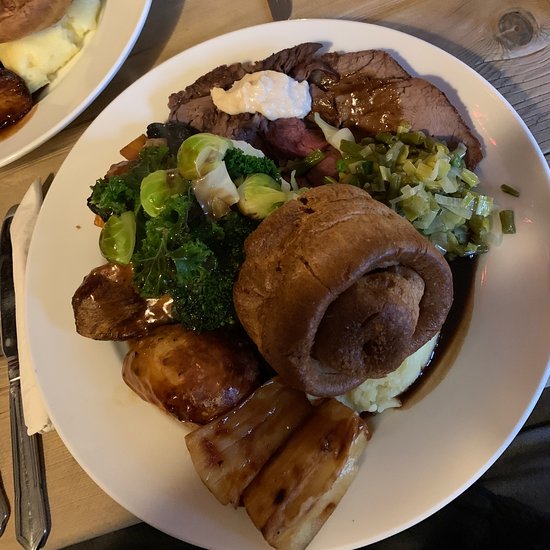
Find the location of a particular element. The width and height of the screenshot is (550, 550). cuttlery is located at coordinates (28, 455), (4, 506), (280, 9).